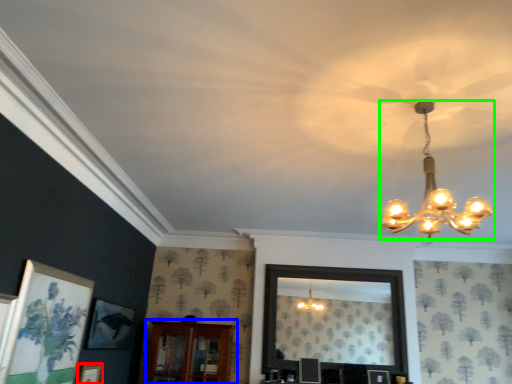
Question: Which object is positioned closest to picture frame (highlighted by a red box)? Select from furniture (highlighted by a blue box) and lamp (highlighted by a green box).

Choices:
 (A) furniture
 (B) lamp

Answer: (A)